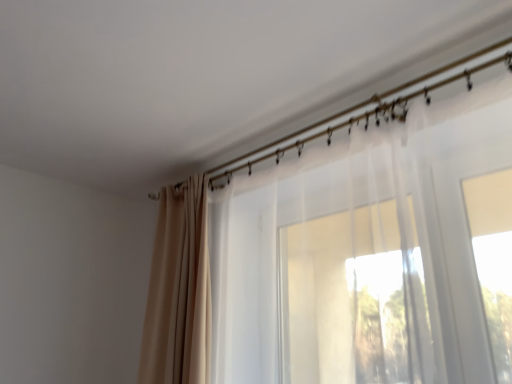
Question: Is metallic gold curtain rod at upper center in front of or behind beige fabric curtain at upper left, the 2th curtain in the right-to-left sequence, in the image?

Choices:
 (A) behind
 (B) front

Answer: (B)

Question: Based on their sizes in the image, would you say metallic gold curtain rod at upper center is bigger or smaller than beige fabric curtain at upper left, the 2th curtain in the right-to-left sequence?

Choices:
 (A) small
 (B) big

Answer: (A)

Question: Which object is positioned farthest from the beige fabric curtain at upper left, the 2th curtain in the right-to-left sequence?

Choices:
 (A) metallic gold curtain rod at upper center
 (B) translucent white curtain at center, the first curtain from the right

Answer: (A)

Question: Based on their relative distances, which object is nearer to the metallic gold curtain rod at upper center?

Choices:
 (A) translucent white curtain at center, acting as the second curtain starting from the left
 (B) beige fabric curtain at upper left, which is counted as the 1th curtain, starting from the left

Answer: (A)